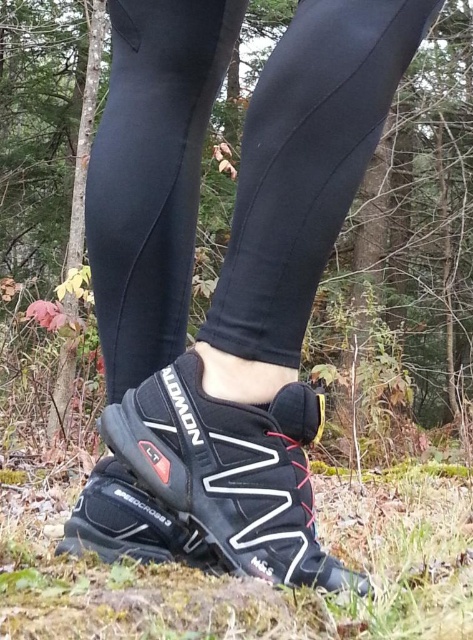
You are a photographer trying to capture the black matte leggings at center and the black mesh shoe at center in a single frame. Since you want both items to be visible, which one should you adjust your camera focus towards first to ensure both are in frame?

The black matte leggings at center is to the right of black mesh shoe at center, so you should focus on the black mesh shoe at center first to ensure both items are within the camera frame.

You are a photographer trying to capture the black matte leggings at center and the black mesh shoe at center in a close shot. Since the camera can only focus on one object at a time, which object should you choose to ensure the larger one is in focus?

The black matte leggings at center is bigger than the black mesh shoe at center, so you should focus on the black matte leggings at center to ensure the larger one is in focus.

You are a photographer setting up a shoot in a forest. You need to ensure that the black matte leggings at center and the black mesh shoe at center are visible in the final image. Based on their positions, which one should you focus on first to ensure both are in focus?

The black matte leggings at center is above the black mesh shoe at center, so focusing on the leggings first will help ensure both are in focus as they are stacked vertically.